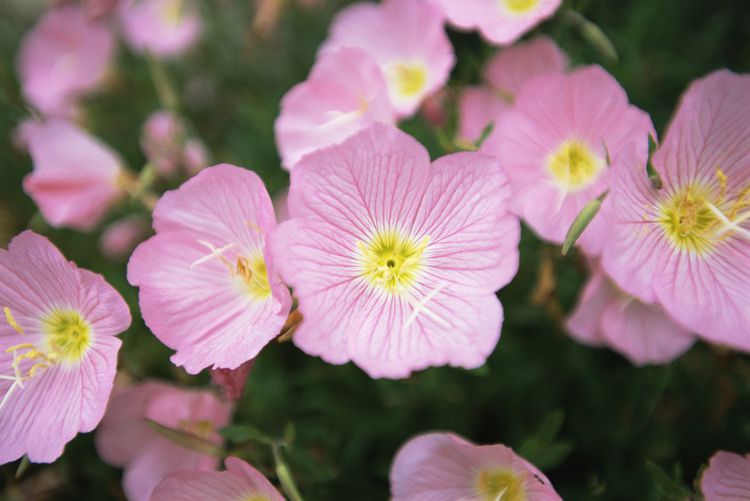
This screenshot has height=501, width=750. What are the coordinates of `middle flower` in the screenshot? It's located at (394, 213), (358, 221), (429, 316), (454, 301), (381, 297), (346, 287).